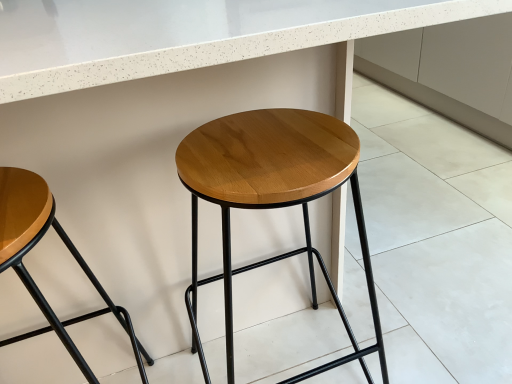
Question: Based on their positions, is wooden/matte stool at center, which is the second stool in left-to-right order, located to the left or right of wooden seat at left, the 1th stool when ordered from left to right?

Choices:
 (A) right
 (B) left

Answer: (A)

Question: In terms of width, does wooden/matte stool at center, placed as the 1th stool when sorted from right to left, look wider or thinner when compared to wooden seat at left, the 1th stool when ordered from left to right?

Choices:
 (A) thin
 (B) wide

Answer: (B)

Question: Which is correct: wooden/matte stool at center, which is the second stool in left-to-right order, is inside wooden seat at left, the 2th stool from the right, or outside of it?

Choices:
 (A) outside
 (B) inside

Answer: (A)

Question: Based on their sizes in the image, would you say wooden seat at left, the 1th stool when ordered from left to right, is bigger or smaller than wooden/matte stool at center, which is the second stool in left-to-right order?

Choices:
 (A) big
 (B) small

Answer: (B)

Question: Based on their positions, is wooden seat at left, the 1th stool when ordered from left to right, located to the left or right of wooden/matte stool at center, which is the second stool in left-to-right order?

Choices:
 (A) left
 (B) right

Answer: (A)

Question: Considering the positions of wooden seat at left, the 2th stool from the right, and wooden/matte stool at center, placed as the 1th stool when sorted from right to left, in the image, is wooden seat at left, the 2th stool from the right, taller or shorter than wooden/matte stool at center, placed as the 1th stool when sorted from right to left,?

Choices:
 (A) short
 (B) tall

Answer: (A)

Question: From a real-world perspective, is wooden seat at left, the 1th stool when ordered from left to right, above or below wooden/matte stool at center, which is the second stool in left-to-right order?

Choices:
 (A) above
 (B) below

Answer: (A)